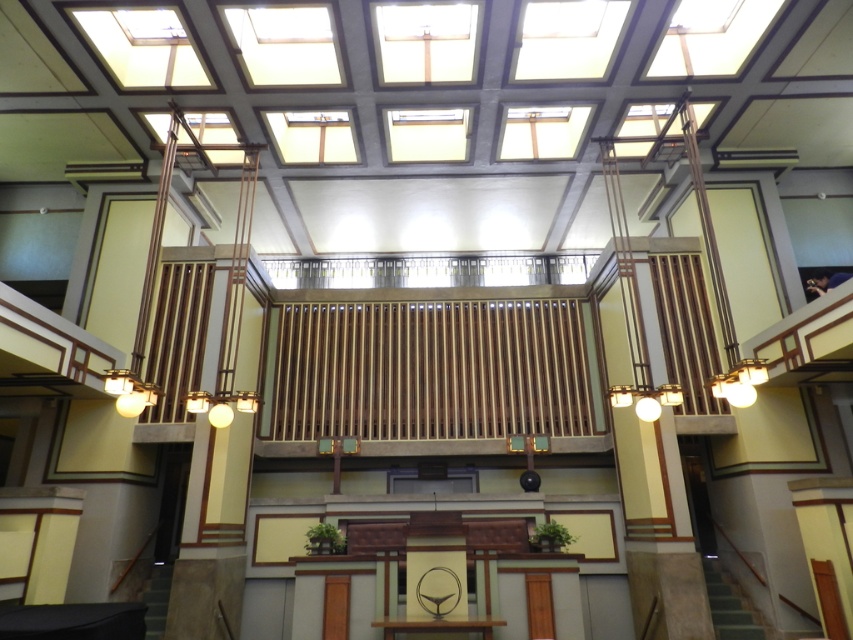
You are at the lower level of the building and need to reach the balcony above. You see the green carpeted stairs at lower right and the dark gray concrete stairs at lower left. Which staircase should you take to reach the balcony?

The green carpeted stairs at lower right is located above the dark gray concrete stairs at lower left, so you should take the green carpeted stairs at lower right to reach the balcony.

You are a visitor entering the building and want to reach the balcony in the center. You see the green carpeted stairs at lower right and the dark gray concrete stairs at lower left. Which set of stairs should you take to reach the balcony?

The green carpeted stairs at lower right is smaller than dark gray concrete stairs at lower left, so you should take the dark gray concrete stairs at lower left to reach the balcony since they are larger and more likely to lead to the central balcony.

You are standing at the entrance of the building and want to reach the stage area. You see the green carpeted stairs at lower right and the dark gray concrete stairs at lower left. Which direction should you go to take the stairs closest to the stage?

The green carpeted stairs at lower right are to the right of the dark gray concrete stairs at lower left. Since the stage is in the center, the closest stairs would depend on your starting position. However, based on their positions, if you are at the entrance and the stage is centrally located, taking either stairs might be equally accessible. But since the question asks for the closest, we need more information about the exact layout. However, according to the given description, the green carpeted stairs